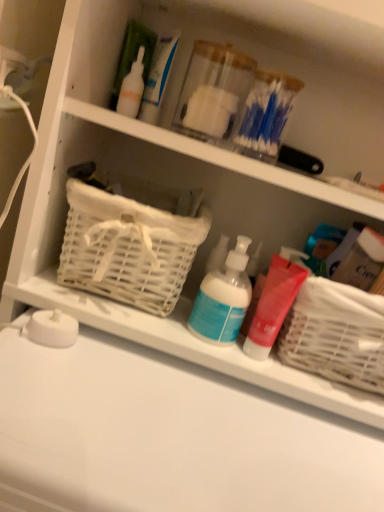
Identify the location of free space in front of matte red pump bottle at center, which ranks as the 1th cleaning product in right-to-left order. (233, 431).